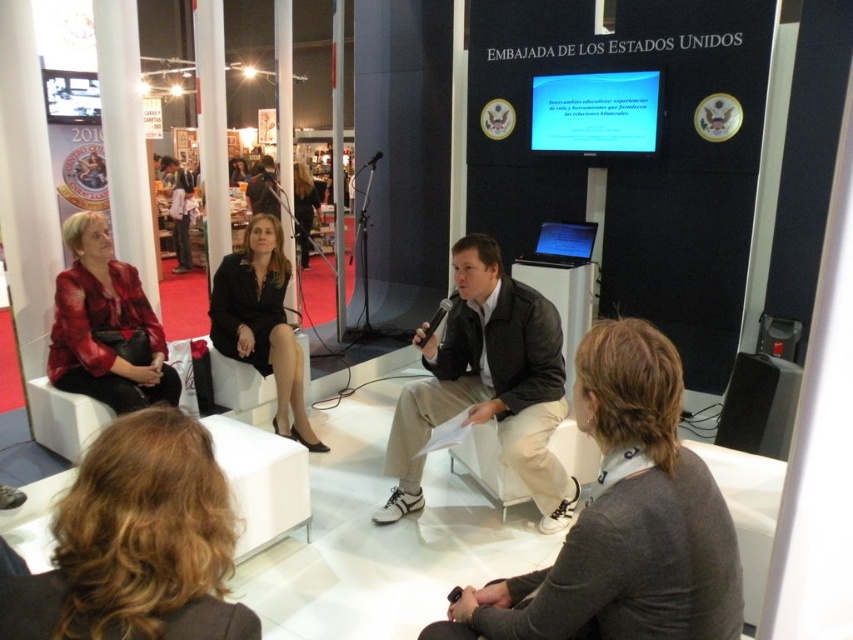
You are standing at point (74, 307) and want to walk to point (582, 618). Is the point you want to reach in front of you?

Yes, the point (582, 618) is in front of point (74, 307), so the destination is in front of you.

You are an event organizer who needs to adjust the seating arrangement for better visibility. The gray sweater at lower center and the black leather jacket at center are currently blocking the view of some attendees. Which clothing item should you move to improve visibility, and why?

The gray sweater at lower center should be moved because it is shorter than the black leather jacket at center, making it the better option to relocate for improved visibility.